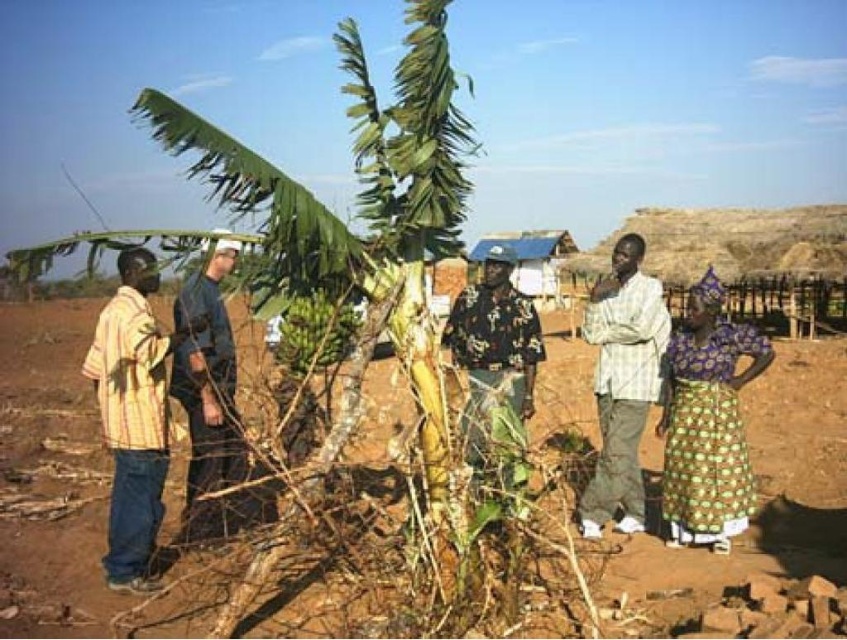
You are a photographer standing at the back of the group. You want to take a photo that includes both the yellow striped shirt at left and the white checkered shirt at center. Which person should you focus on first to ensure both are in frame?

You should focus on the yellow striped shirt at left first because it is taller than the white checkered shirt at center, so it will be easier to frame both by starting with the taller individual.